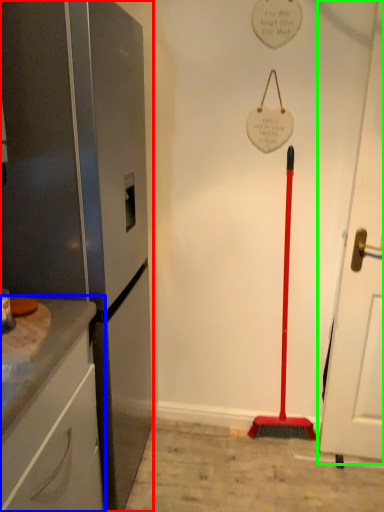
Question: Based on their relative distances, which object is nearer to appliance (highlighted by a red box)? Choose from cabinetry (highlighted by a blue box) and door (highlighted by a green box).

Choices:
 (A) cabinetry
 (B) door

Answer: (A)